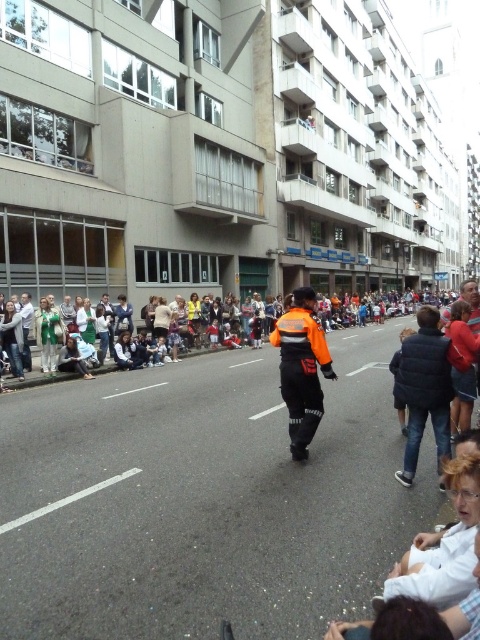
You are a pedestrian trying to cross the street at the event. You see a black puffer jacket at lower right and an orange reflective jacket at center. Which clothing item is narrower in width?

The black puffer jacket at lower right is thinner than the orange reflective jacket at center, so the black puffer jacket at lower right is narrower in width.

You are standing at the origin point of the image. Where is the orange fabric jacket at center located in terms of coordinates?

The orange fabric jacket at center is located at coordinates point [301,369].